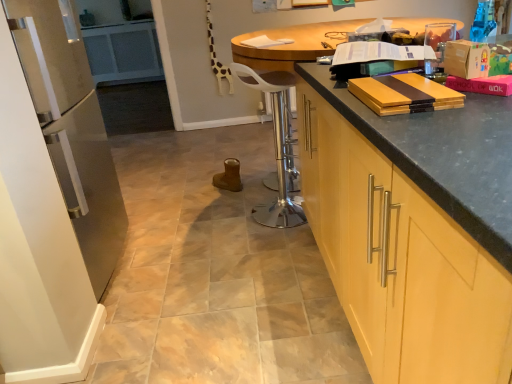
What is the approximate height of matte black countertop at right?

matte black countertop at right is 95.20 centimeters in height.

In order to face matte black countertop at right, should I rotate leftwards or rightwards?

Turn right approximately 11.353 degrees to face it.

This screenshot has height=384, width=512. Identify the location of yellow wood cutting board at upper right, the fourth book from the back. (404, 94).

What is the approximate width of white glossy refrigerator at left?

It is 16.91 inches.

What do you see at coordinates (482, 84) in the screenshot? This screenshot has height=384, width=512. I see `matte cardboard book at upper right, the third book in the back-to-front sequence` at bounding box center [482, 84].

I want to click on matte yellow wood book at upper right, which appears as the 2th book when viewed from the back, so click(x=374, y=58).

Considering the positions of point (453, 125) and point (414, 180), is point (453, 125) closer or farther from the camera than point (414, 180)?

Point (453, 125) appears to be farther away from the viewer than point (414, 180).

Considering the sizes of objects matte black countertop at right and yellow wood cabinet at right in the image provided, who is taller, matte black countertop at right or yellow wood cabinet at right?

matte black countertop at right.

Is matte black countertop at right located outside yellow wood cabinet at right?

matte black countertop at right is positioned outside yellow wood cabinet at right.

Is matte black countertop at right bigger than yellow wood cabinet at right?

Correct, matte black countertop at right is larger in size than yellow wood cabinet at right.

Considering the positions of points (377, 45) and (369, 99), is point (377, 45) farther from camera compared to point (369, 99)?

That is True.

Does matte yellow wood book at upper right, which ranks as the 2th book in top-to-bottom order, have a lesser height compared to yellow wood cutting board at upper right, the 1th book when ordered from front to back?

No.

From a real-world perspective, does matte yellow wood book at upper right, the 3th book in the bottom-to-top sequence, stand above yellow wood cutting board at upper right, marked as the 4th book in a top-to-bottom arrangement?

Yes.

Is matte yellow wood book at upper right, which appears as the 2th book when viewed from the back, looking in the opposite direction of yellow wood cutting board at upper right, the 1th book when ordered from front to back?

matte yellow wood book at upper right, which appears as the 2th book when viewed from the back, does not have its back to yellow wood cutting board at upper right, the 1th book when ordered from front to back.

Based on the photo, measure the distance between white paper at center, the first book viewed from the top, and matte black countertop at right.

The distance of white paper at center, the first book viewed from the top, from matte black countertop at right is 19.74 inches.

Is white paper at center, the fourth book viewed from the front, positioned with its back to matte black countertop at right?

No.

From the picture: Is white paper at center, which ranks as the 1th book in back-to-front order, at the left side of matte black countertop at right?

Correct, you'll find white paper at center, which ranks as the 1th book in back-to-front order, to the left of matte black countertop at right.

From a real-world perspective, is white paper at center, which ranks as the 1th book in back-to-front order, below matte black countertop at right?

No.

From a real-world perspective, relative to white glossy refrigerator at left, is yellow wood cutting board at upper right, the 1th book when ordered from front to back, vertically above or below?

In terms of real-world spatial position, yellow wood cutting board at upper right, the 1th book when ordered from front to back, is above white glossy refrigerator at left.

In the scene shown: From the image's perspective, which object appears higher, yellow wood cutting board at upper right, the 1th book when ordered from front to back, or white glossy refrigerator at left?

From the image's view, yellow wood cutting board at upper right, the 1th book when ordered from front to back, is above.

Is white glossy refrigerator at left at the back of yellow wood cutting board at upper right, the fourth book from the back?

yellow wood cutting board at upper right, the fourth book from the back, does not have its back to white glossy refrigerator at left.

How distant is yellow wood cutting board at upper right, the fourth book from the back, from white glossy refrigerator at left?

yellow wood cutting board at upper right, the fourth book from the back, and white glossy refrigerator at left are 1.23 meters apart.

Is yellow wood cutting board at upper right, the fourth book from the back, not near matte yellow wood book at upper right, the 3th book in the bottom-to-top sequence?

yellow wood cutting board at upper right, the fourth book from the back, is actually quite close to matte yellow wood book at upper right, the 3th book in the bottom-to-top sequence.

Which is correct: yellow wood cutting board at upper right, marked as the 4th book in a top-to-bottom arrangement, is inside matte yellow wood book at upper right, which appears as the 2th book when viewed from the back, or outside of it?

yellow wood cutting board at upper right, marked as the 4th book in a top-to-bottom arrangement, exists outside the volume of matte yellow wood book at upper right, which appears as the 2th book when viewed from the back.

Does point (436, 93) appear closer or farther from the camera than point (353, 50)?

Point (436, 93) is positioned closer to the camera compared to point (353, 50).

From the image's perspective, is yellow wood cabinet at right beneath yellow wood cutting board at upper right, the fourth book from the back?

Yes.

Considering the positions of objects yellow wood cabinet at right and yellow wood cutting board at upper right, which is the first book from bottom to top, in the image provided, who is more to the left, yellow wood cabinet at right or yellow wood cutting board at upper right, which is the first book from bottom to top,?

Positioned to the left is yellow wood cutting board at upper right, which is the first book from bottom to top.

Does yellow wood cabinet at right turn towards yellow wood cutting board at upper right, which is the first book from bottom to top?

No, yellow wood cabinet at right is not facing towards yellow wood cutting board at upper right, which is the first book from bottom to top.

How different are the orientations of yellow wood cabinet at right and yellow wood cutting board at upper right, the 1th book when ordered from front to back, in degrees?

They differ by 88.9 degrees in their facing directions.

From the image's perspective, is white paper at center, the fourth book from the bottom, on matte cardboard book at upper right, the third book in the back-to-front sequence?

Yes.

Is white paper at center, the fourth book from the bottom, thinner than matte cardboard book at upper right, the second book positioned from the front?

No.

Which is less distant, (263, 40) or (511, 88)?

Point (263, 40).

How distant is white paper at center, the first book viewed from the top, from matte cardboard book at upper right, the second book positioned from the front?

The distance of white paper at center, the first book viewed from the top, from matte cardboard book at upper right, the second book positioned from the front, is 3.34 feet.

Where is `counter top that is on the left side of yellow wood cabinet at right`? Image resolution: width=512 pixels, height=384 pixels. counter top that is on the left side of yellow wood cabinet at right is located at coordinates (420, 138).

From a real-world perspective, starting from the matte yellow wood book at upper right, the 3th book in the bottom-to-top sequence, which book is the 2nd one below it? Please provide its 2D coordinates.

[(404, 94)]

Looking at the image, which one is located closer to yellow wood cabinet at right, matte yellow wood book at upper right, the 3th book in the bottom-to-top sequence, or metallic silver bar stool at center?

The object closer to yellow wood cabinet at right is matte yellow wood book at upper right, the 3th book in the bottom-to-top sequence.

Which object lies nearer to the anchor point yellow wood cabinet at right, matte cardboard book at upper right, the third book viewed from the top, or metallic silver bar stool at center?

matte cardboard book at upper right, the third book viewed from the top, is positioned closer to the anchor yellow wood cabinet at right.

When comparing their distances from yellow wood cutting board at upper right, marked as the 4th book in a top-to-bottom arrangement, does matte yellow wood book at upper right, arranged as the 3th book when viewed from the front, or matte cardboard book at upper right, the third book viewed from the top, seem closer?

The object closer to yellow wood cutting board at upper right, marked as the 4th book in a top-to-bottom arrangement, is matte cardboard book at upper right, the third book viewed from the top.

From the image, which object appears to be farther from white glossy refrigerator at left, yellow wood cutting board at upper right, marked as the 4th book in a top-to-bottom arrangement, or yellow wood cabinet at right?

yellow wood cutting board at upper right, marked as the 4th book in a top-to-bottom arrangement, is positioned further to the anchor white glossy refrigerator at left.

Based on their spatial positions, is matte yellow wood book at upper right, arranged as the 3th book when viewed from the front, or yellow wood cutting board at upper right, which is the first book from bottom to top, closer to yellow wood cabinet at right?

yellow wood cutting board at upper right, which is the first book from bottom to top, lies closer to yellow wood cabinet at right than the other object.

Which object lies further to the anchor point metallic silver bar stool at center, yellow wood cutting board at upper right, the fourth book from the back, or matte black countertop at right?

yellow wood cutting board at upper right, the fourth book from the back.

Estimate the real-world distances between objects in this image. Which object is closer to yellow wood cutting board at upper right, which is the first book from bottom to top, matte cardboard book at upper right, the second book positioned from the front, or matte black countertop at right?

matte cardboard book at upper right, the second book positioned from the front, is positioned closer to the anchor yellow wood cutting board at upper right, which is the first book from bottom to top.

From the image, which object appears to be farther from yellow wood cutting board at upper right, the 1th book when ordered from front to back, metallic silver bar stool at center or matte cardboard book at upper right, the third book in the back-to-front sequence?

The object further to yellow wood cutting board at upper right, the 1th book when ordered from front to back, is metallic silver bar stool at center.

You are a GUI agent. You are given a task and a screenshot of the screen. Output one action in this format:
    pyautogui.click(x=<x>, y=<y>)
    Task: Click on the counter top located between matte cardboard book at upper right, the second book positioned from the front, and metallic silver bar stool at center in the depth direction
    The image size is (512, 384).
    Given the screenshot: What is the action you would take?
    pyautogui.click(x=420, y=138)

The width and height of the screenshot is (512, 384). Identify the location of counter top between yellow wood cutting board at upper right, the fourth book from the back, and metallic silver bar stool at center from front to back. (420, 138).

Find the location of `counter top between matte yellow wood book at upper right, arranged as the 3th book when viewed from the front, and metallic silver bar stool at center, along the z-axis`. counter top between matte yellow wood book at upper right, arranged as the 3th book when viewed from the front, and metallic silver bar stool at center, along the z-axis is located at coordinates coord(420,138).

The image size is (512, 384). Identify the location of counter top between white glossy refrigerator at left and yellow wood cabinet at right from left to right. (420, 138).